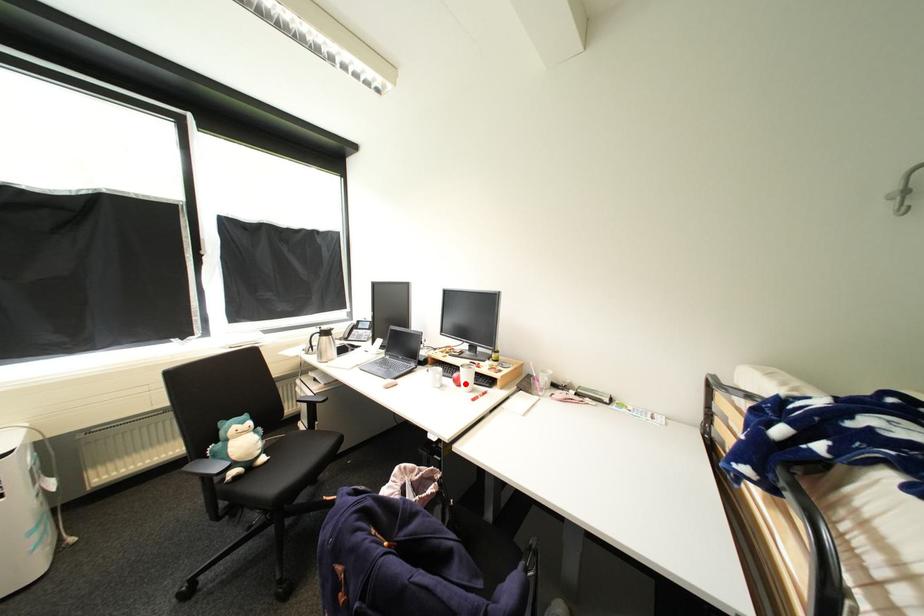
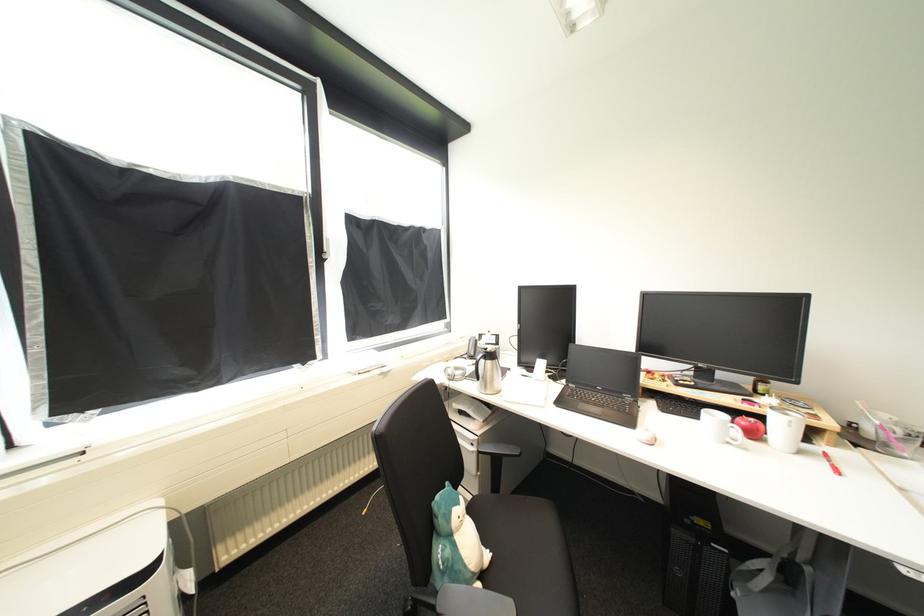
Question: A red point is marked in image1. In image2, is the corresponding 3D point closer to the camera or farther? Reply with the corresponding letter.

Choices:
 (A) The corresponding 3D point is closer.
 (B) The corresponding 3D point is farther.

Answer: (A)